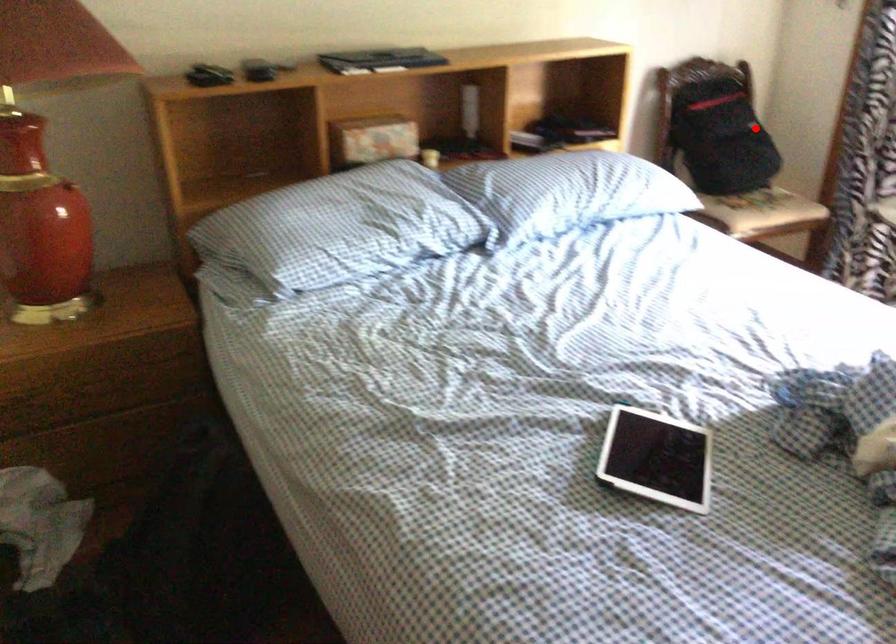
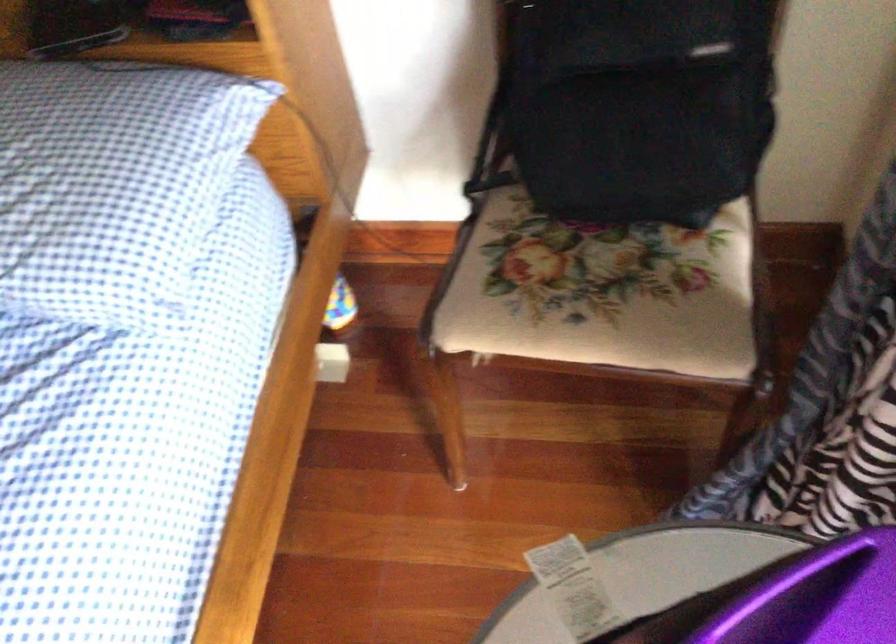
In the second image, find the point that corresponds to the highlighted location in the first image.

(639, 104)